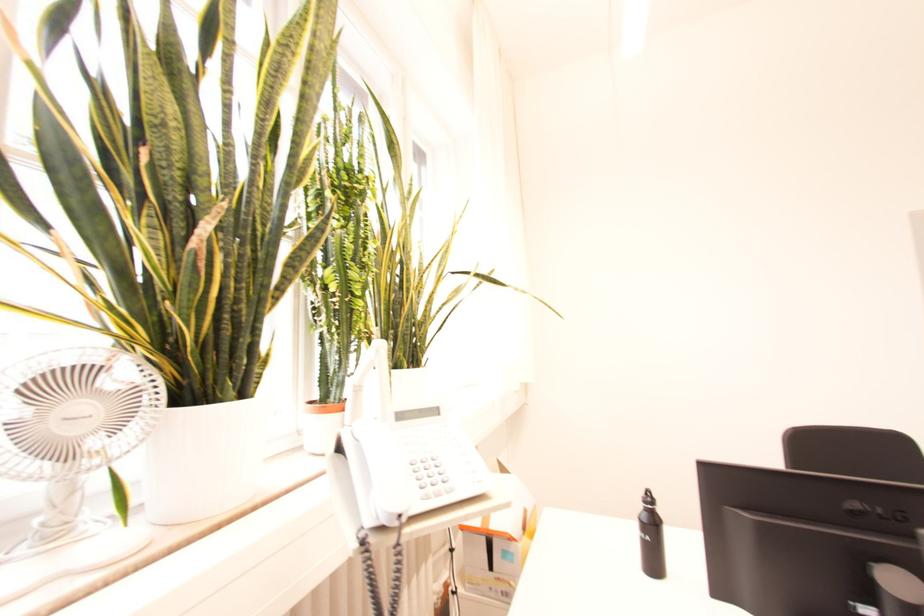
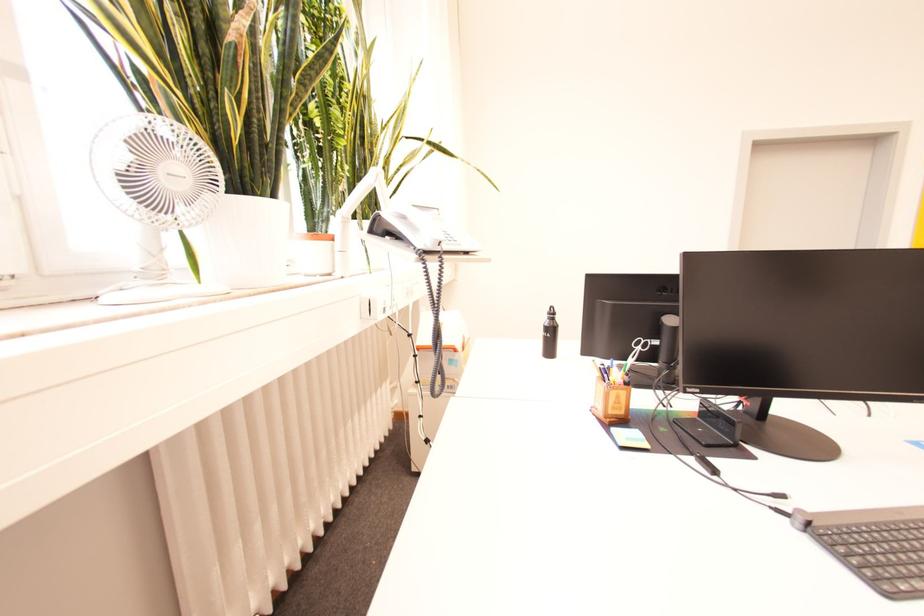
Which direction would the cameraman need to move to produce the second image?

The cameraman moved toward left, backward.